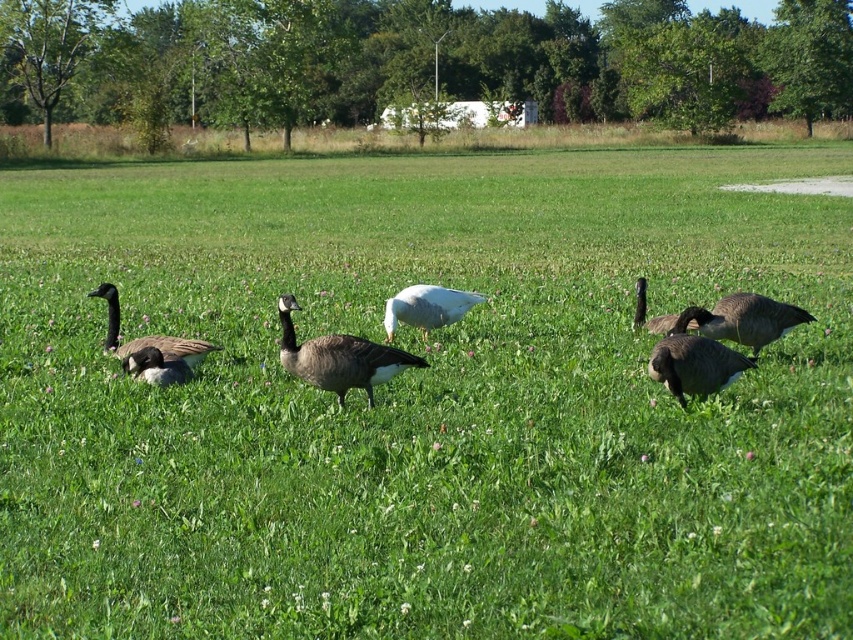
Is dark gray feathered goose at center thinner than dark gray matte duck at lower left?

Incorrect, dark gray feathered goose at center's width is not less than dark gray matte duck at lower left's.

Which is in front, point (682, 321) or point (171, 371)?

Point (682, 321)

Is point (712, 368) behind point (161, 353)?

That is False.

This screenshot has width=853, height=640. I want to click on dark gray feathered goose at center, so click(x=694, y=358).

Is dark gray matte goose at center bigger than dark gray matte duck at lower left?

Yes, dark gray matte goose at center is bigger than dark gray matte duck at lower left.

Which is above, dark gray matte goose at center or dark gray matte duck at lower left?

dark gray matte goose at center is above.

Who is more forward, (389, 365) or (160, 358)?

Point (389, 365) is more forward.

The image size is (853, 640). Identify the location of dark gray matte goose at center. 338,356.

Can you confirm if dark gray feathered goose at center is positioned above dark brown feathered goose at right?

Actually, dark gray feathered goose at center is below dark brown feathered goose at right.

Between point (677, 397) and point (648, 330), which one is positioned in front?

Point (677, 397) is in front.

Find the location of a particular element. The image size is (853, 640). dark gray feathered goose at center is located at coordinates (694, 358).